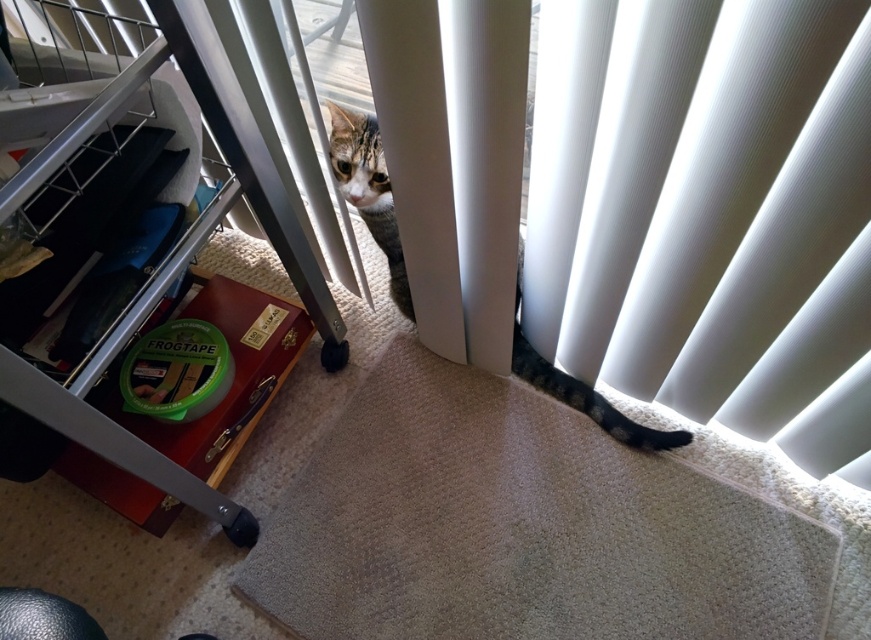
Question: Among these objects, which one is nearest to the camera?

Choices:
 (A) white textured blinds at lower right
 (B) tabby fur cat at center

Answer: (A)

Question: Does white textured blinds at lower right come in front of tabby fur cat at center?

Choices:
 (A) no
 (B) yes

Answer: (B)

Question: Which of these objects is positioned farthest from the brushed metal drawer at lower left?

Choices:
 (A) tabby fur cat at center
 (B) white textured blinds at lower right

Answer: (B)

Question: Estimate the real-world distances between objects in this image. Which object is closer to the tabby fur cat at center?

Choices:
 (A) brushed metal drawer at lower left
 (B) white textured blinds at lower right

Answer: (A)

Question: Considering the relative positions of white textured blinds at lower right and tabby fur cat at center in the image provided, where is white textured blinds at lower right located with respect to tabby fur cat at center?

Choices:
 (A) above
 (B) below

Answer: (B)

Question: Observing the image, what is the correct spatial positioning of white textured blinds at lower right in reference to brushed metal drawer at lower left?

Choices:
 (A) right
 (B) left

Answer: (A)